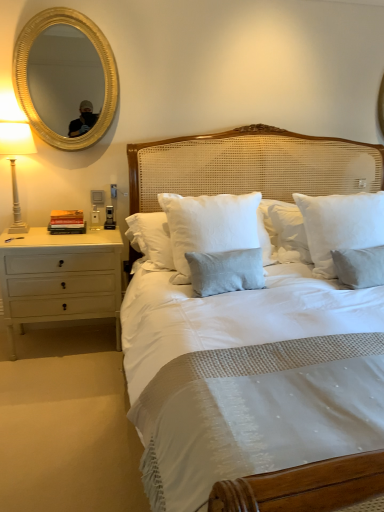
Question: Does gold metallic mirror at upper left have a larger size compared to white cotton pillow at center, the second pillow from the right?

Choices:
 (A) yes
 (B) no

Answer: (B)

Question: From the image's perspective, would you say gold metallic mirror at upper left is positioned over white cotton pillow at center, the second pillow from the right?

Choices:
 (A) no
 (B) yes

Answer: (B)

Question: Could you tell me if gold metallic mirror at upper left is turned towards white cotton pillow at center, the second pillow from the right?

Choices:
 (A) yes
 (B) no

Answer: (B)

Question: Considering the relative sizes of gold metallic mirror at upper left and white cotton pillow at center, the second pillow from the right, in the image provided, is gold metallic mirror at upper left wider than white cotton pillow at center, the second pillow from the right,?

Choices:
 (A) yes
 (B) no

Answer: (B)

Question: From the image's perspective, is gold metallic mirror at upper left located beneath white cotton pillow at center, the second pillow from the right?

Choices:
 (A) no
 (B) yes

Answer: (A)

Question: From a real-world perspective, is gold metallic mirror at upper left located beneath white cotton pillow at center, the second pillow from the right?

Choices:
 (A) yes
 (B) no

Answer: (B)

Question: Would you say white ceramic lamp at left is outside white cotton pillow at center, the 2th pillow viewed from the left?

Choices:
 (A) no
 (B) yes

Answer: (B)

Question: Is white ceramic lamp at left positioned with its back to white cotton pillow at center, marked as the 1th pillow in a right-to-left arrangement?

Choices:
 (A) no
 (B) yes

Answer: (A)

Question: Would you consider white ceramic lamp at left to be distant from white cotton pillow at center, the 2th pillow viewed from the left?

Choices:
 (A) no
 (B) yes

Answer: (B)

Question: From the image's perspective, does white ceramic lamp at left appear higher than white cotton pillow at center, marked as the 1th pillow in a right-to-left arrangement?

Choices:
 (A) yes
 (B) no

Answer: (A)

Question: Considering the relative sizes of white ceramic lamp at left and white cotton pillow at center, the 2th pillow viewed from the left, in the image provided, is white ceramic lamp at left thinner than white cotton pillow at center, the 2th pillow viewed from the left,?

Choices:
 (A) no
 (B) yes

Answer: (A)

Question: Would you say white cotton pillow at center, the 2th pillow viewed from the left, is part of white ceramic lamp at left's contents?

Choices:
 (A) yes
 (B) no

Answer: (B)

Question: Considering the relative positions of white wood nightstand at left and gold metallic mirror at upper left in the image provided, is white wood nightstand at left in front of gold metallic mirror at upper left?

Choices:
 (A) no
 (B) yes

Answer: (A)